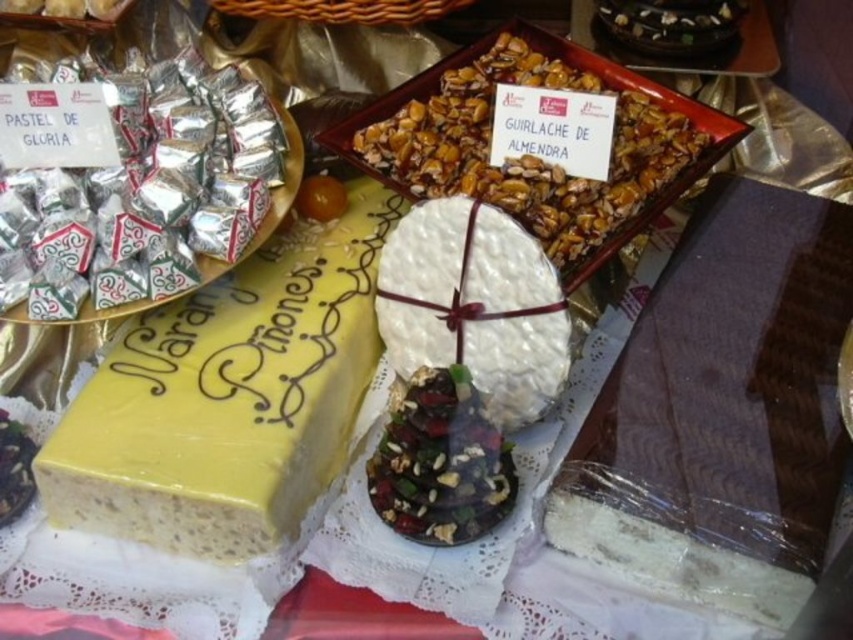
You are a customer at a bakery and want to buy both the shiny almond brittle at center and the white textured cake at center. The store has a special offer where if one item is larger than the other, you can get the smaller one for half price. Which item would be eligible for the discount?

The white textured cake at center would be eligible for the discount since it is smaller than the shiny almond brittle at center according to the description.

You are a customer at the bakery and want to buy both the shiny almond brittle at center and the white textured cake at center. However, you have a small bag that can only hold items that are in front of each other. Which item should you pick first to ensure it fits in your bag?

The white textured cake at center is behind the shiny almond brittle at center, so the shiny almond brittle at center is in front. Therefore, you should pick the shiny almond brittle at center first to ensure it fits in your bag since it is in front and likely accessible without moving the cake.